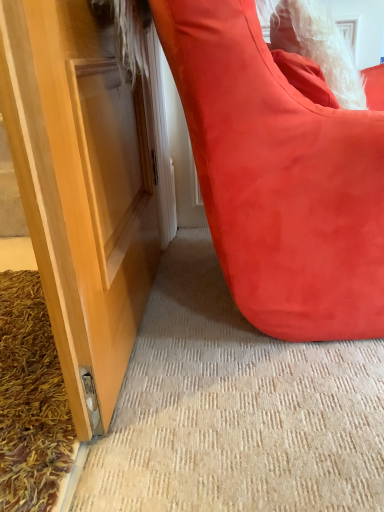
Question: From the image's perspective, is suede-like red bean bag at lower right on top of shaggy brown doormat at lower left?

Choices:
 (A) no
 (B) yes

Answer: (B)

Question: Is suede-like red bean bag at lower right looking in the opposite direction of shaggy brown doormat at lower left?

Choices:
 (A) yes
 (B) no

Answer: (B)

Question: Is suede-like red bean bag at lower right behind shaggy brown doormat at lower left?

Choices:
 (A) no
 (B) yes

Answer: (A)

Question: Is shaggy brown doormat at lower left inside suede-like red bean bag at lower right?

Choices:
 (A) yes
 (B) no

Answer: (B)

Question: Could you tell me if suede-like red bean bag at lower right is turned towards shaggy brown doormat at lower left?

Choices:
 (A) no
 (B) yes

Answer: (A)

Question: Can you confirm if suede-like red bean bag at lower right is smaller than shaggy brown doormat at lower left?

Choices:
 (A) no
 (B) yes

Answer: (A)

Question: Is shaggy brown doormat at lower left touching suede-like red bean bag at lower right?

Choices:
 (A) yes
 (B) no

Answer: (B)

Question: From a real-world perspective, is shaggy brown doormat at lower left on top of suede-like red bean bag at lower right?

Choices:
 (A) no
 (B) yes

Answer: (A)

Question: Is shaggy brown doormat at lower left not within suede-like red bean bag at lower right?

Choices:
 (A) yes
 (B) no

Answer: (A)

Question: Can you confirm if shaggy brown doormat at lower left is bigger than suede-like red bean bag at lower right?

Choices:
 (A) no
 (B) yes

Answer: (A)

Question: Is shaggy brown doormat at lower left far away from suede-like red bean bag at lower right?

Choices:
 (A) no
 (B) yes

Answer: (A)

Question: Can you confirm if shaggy brown doormat at lower left is taller than suede-like red bean bag at lower right?

Choices:
 (A) yes
 (B) no

Answer: (B)

Question: From a real-world perspective, is suede-like red bean bag at lower right physically located above or below shaggy brown doormat at lower left?

Choices:
 (A) above
 (B) below

Answer: (A)